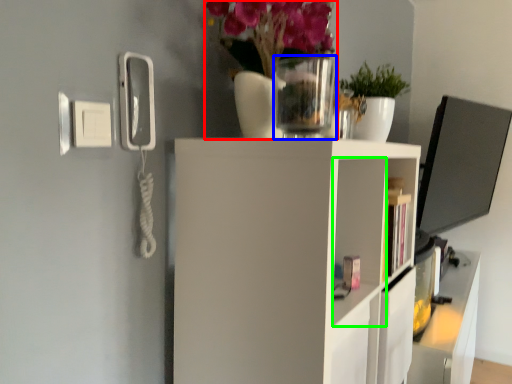
Question: Based on their relative distances, which object is nearer to floral arrangement (highlighted by a red box)? Choose from glass vase (highlighted by a blue box) and cabinet (highlighted by a green box).

Choices:
 (A) glass vase
 (B) cabinet

Answer: (A)